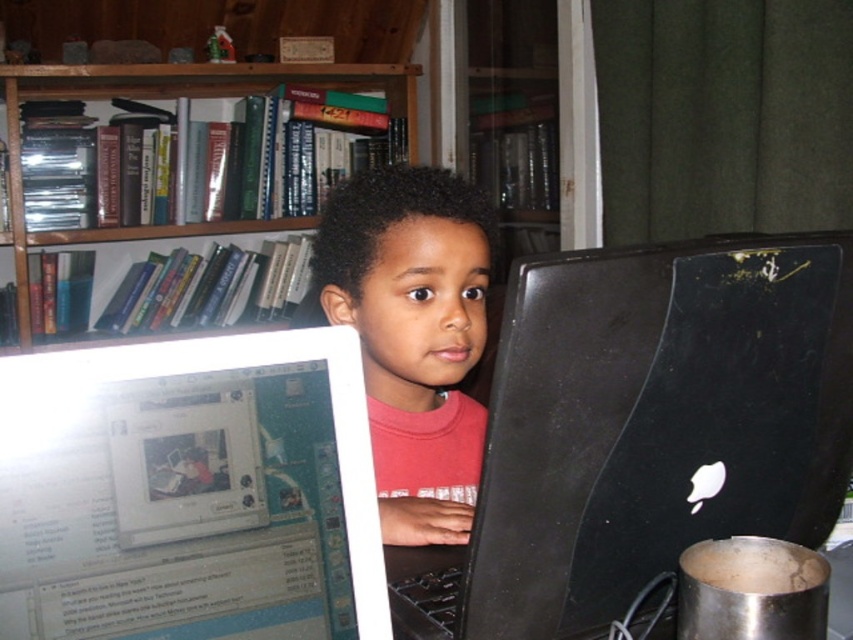
Measure the distance between point (370, 496) and camera.

Point (370, 496) is 24.34 inches from camera.

Which is above, white glossy computer screen at center or pink matte shirt at center?

pink matte shirt at center is above.

Between point (335, 525) and point (482, 225), which one is positioned in front?

Point (335, 525) is in front.

You are a GUI agent. You are given a task and a screenshot of the screen. Output one action in this format:
    pyautogui.click(x=<x>, y=<y>)
    Task: Click on the white glossy computer screen at center
    
    Given the screenshot: What is the action you would take?
    pyautogui.click(x=189, y=492)

Is the position of black matte laptop at center less distant than that of white glossy computer screen at center?

No, it is not.

What do you see at coordinates (643, 428) in the screenshot?
I see `black matte laptop at center` at bounding box center [643, 428].

This screenshot has height=640, width=853. In order to click on black matte laptop at center in this screenshot , I will do `click(643, 428)`.

Who is positioned more to the right, pink matte shirt at center or wooden bookshelf at upper left?

Positioned to the right is pink matte shirt at center.

Can you confirm if pink matte shirt at center is bigger than wooden bookshelf at upper left?

No.

You are a GUI agent. You are given a task and a screenshot of the screen. Output one action in this format:
    pyautogui.click(x=<x>, y=<y>)
    Task: Click on the pink matte shirt at center
    
    Given the screenshot: What is the action you would take?
    click(x=412, y=336)